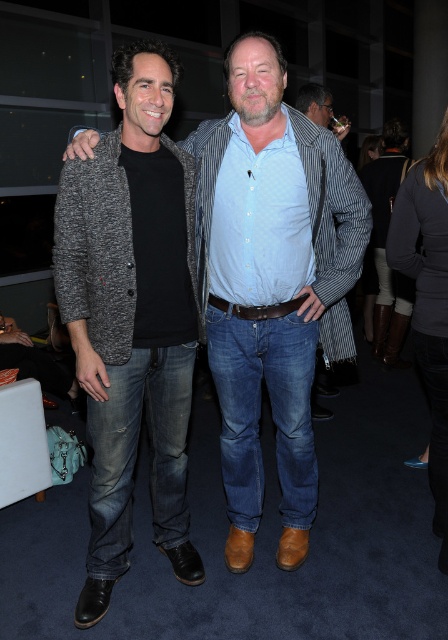
Question: Is matte gray sweater at center to the right of matte gray cardigan at center from the viewer's perspective?

Choices:
 (A) yes
 (B) no

Answer: (A)

Question: Does matte gray sweater at center appear over matte gray cardigan at center?

Choices:
 (A) no
 (B) yes

Answer: (B)

Question: Which point is closer to the camera?

Choices:
 (A) (323, 227)
 (B) (134, 97)

Answer: (B)

Question: Which of the following is the closest to the observer?

Choices:
 (A) matte gray sweater at center
 (B) matte gray cardigan at center

Answer: (B)

Question: Can you confirm if matte gray sweater at center is bigger than matte gray cardigan at center?

Choices:
 (A) no
 (B) yes

Answer: (B)